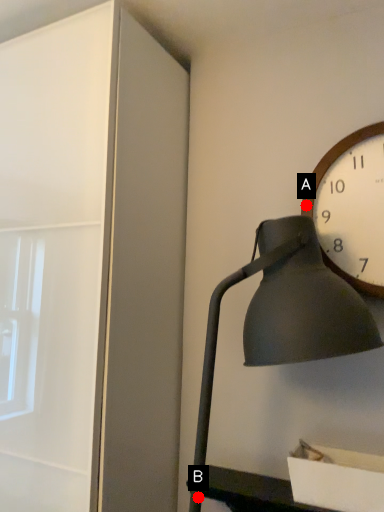
Question: Two points are circled on the image, labeled by A and B beside each circle. Which point appears farthest from the camera in this image?

Choices:
 (A) A is further
 (B) B is further

Answer: (A)